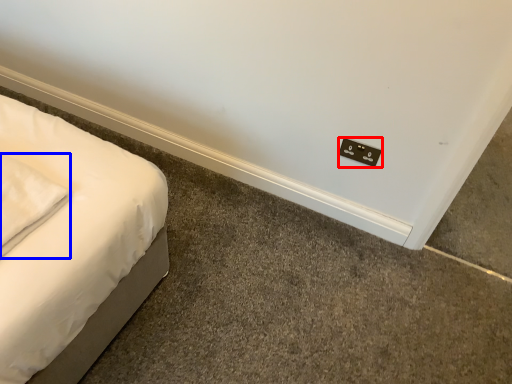
Question: Among these objects, which one is nearest to the camera, electric outlet (highlighted by a red box) or pillow (highlighted by a blue box)?

Choices:
 (A) electric outlet
 (B) pillow

Answer: (B)